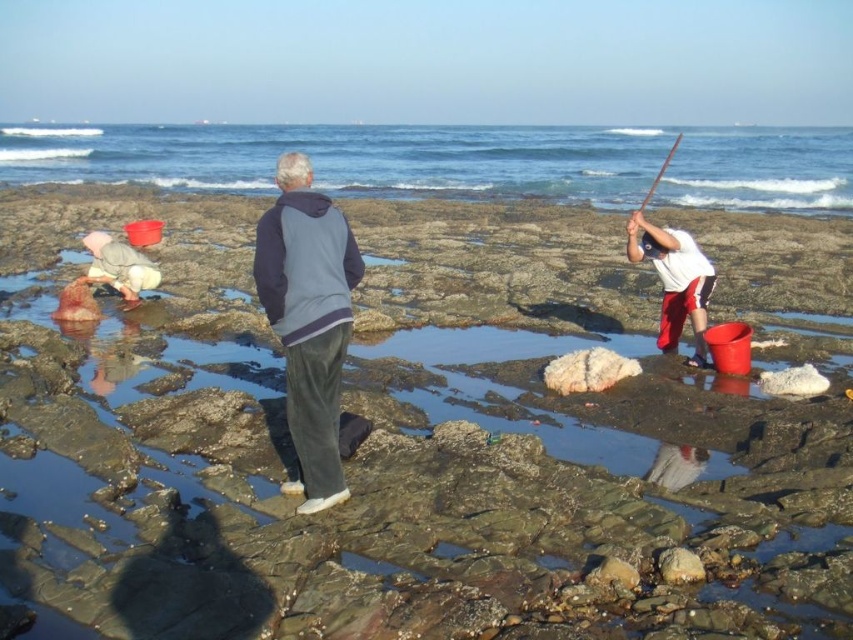
Question: Which object is positioned closest to the light beige cotton pants at lower left?

Choices:
 (A) gray fleece jacket at center
 (B) blue ocean water at upper center
 (C) white cotton shirt at right

Answer: (A)

Question: Where is gray fleece jacket at center located in relation to light beige cotton pants at lower left in the image?

Choices:
 (A) below
 (B) above

Answer: (A)

Question: Is white cotton shirt at right behind light beige cotton pants at lower left?

Choices:
 (A) yes
 (B) no

Answer: (B)

Question: Which of the following is the farthest from the observer?

Choices:
 (A) gray fleece jacket at center
 (B) white cotton shirt at right
 (C) blue ocean water at upper center
 (D) light beige cotton pants at lower left

Answer: (C)

Question: Does blue ocean water at upper center have a larger size compared to white cotton shirt at right?

Choices:
 (A) no
 (B) yes

Answer: (B)

Question: Which object is the closest to the light beige cotton pants at lower left?

Choices:
 (A) blue ocean water at upper center
 (B) white cotton shirt at right

Answer: (B)